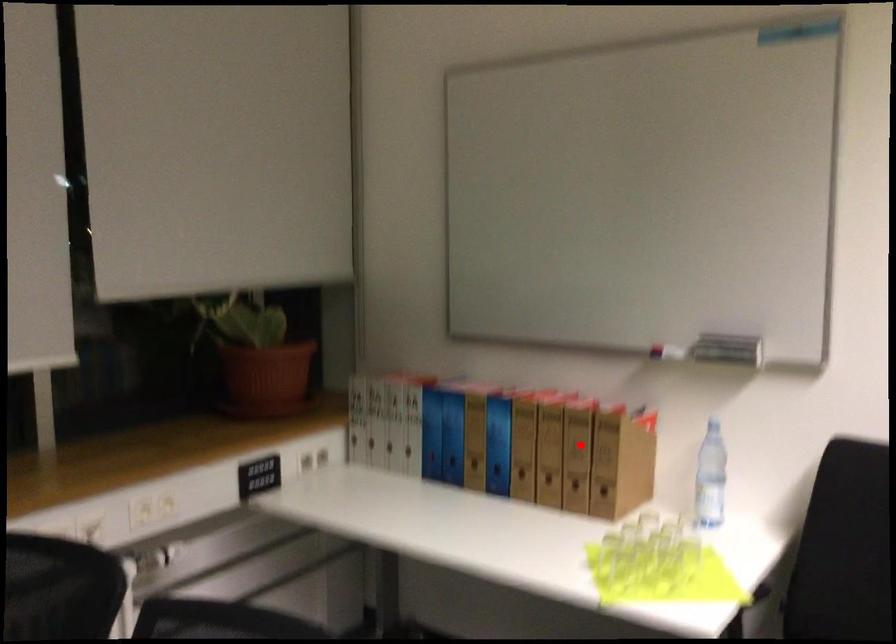
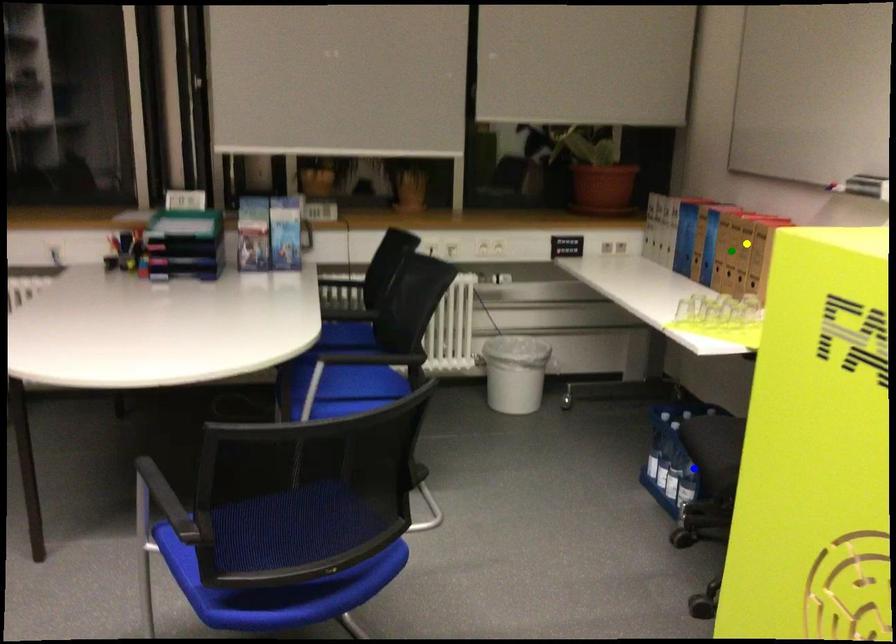
Question: I am providing you with two images of the same scene from different viewpoints. A red point is marked on the first image. You are given multiple points on the second image. In image 2, which mark is for the same physical point as the one in image 1?

Choices:
 (A) green point
 (B) blue point
 (C) yellow point

Answer: (C)